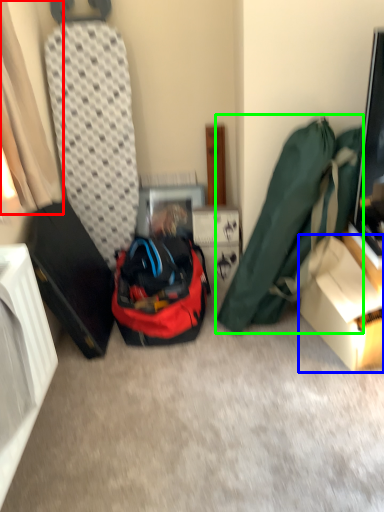
Question: Which object is positioned farthest from curtain (highlighted by a red box)? Select from box (highlighted by a blue box) and luggage and bags (highlighted by a green box).

Choices:
 (A) box
 (B) luggage and bags

Answer: (A)